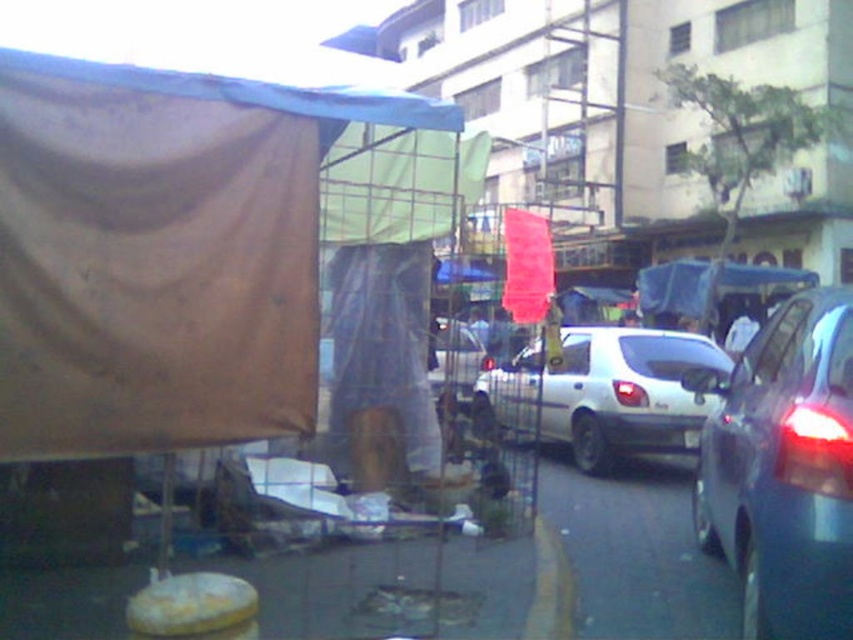
You are standing at the corner of the street and want to locate the brown fabric canopy at upper left. According to the coordinate system where the bottom left corner is the origin, can you tell me its exact location?

The brown fabric canopy at upper left is located at coordinate point [163,252].

You are a delivery person trying to park your vehicle in a tight space. You see a white matte hatchback at center and a white plastic license plate at center in the image. Which object is wider?

The white matte hatchback at center is wider than the white plastic license plate at center according to the description.

Consider the image. You are a delivery person needing to park your vehicle in this area. You have a trailer attached that requires extra space. Which vehicle, the metallic gray sedan at right or the metallic silver car at center, would you need to move to accommodate your trailer?

The metallic gray sedan at right has a larger size compared to the metallic silver car at center, so you would need to move the metallic gray sedan at right to accommodate your trailer since it takes up more space.